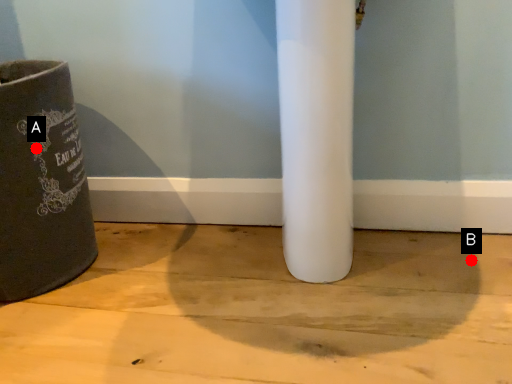
Question: Two points are circled on the image, labeled by A and B beside each circle. Which point appears farthest from the camera in this image?

Choices:
 (A) A is further
 (B) B is further

Answer: (B)